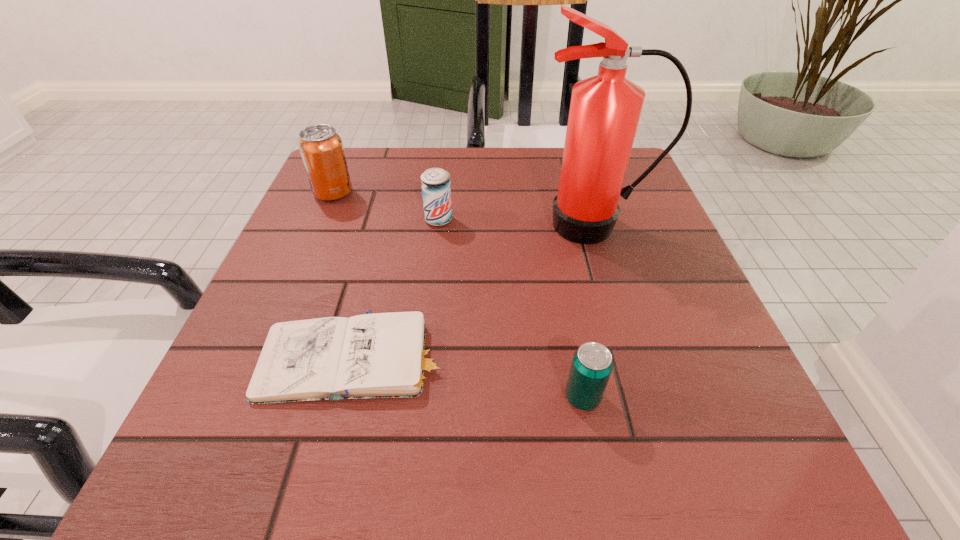
At what (x,y) coordinates should I click in order to perform the action: click on fire extinguisher. Please return your answer as a coordinate pair (x, y). The height and width of the screenshot is (540, 960). Looking at the image, I should click on (604, 112).

Where is `soda can`? soda can is located at coordinates (321, 148).

I want to click on the farthest object, so pyautogui.click(x=321, y=148).

The image size is (960, 540). What are the coordinates of `the farther beer can` in the screenshot? It's located at (436, 191).

Find the location of a particular element. The height and width of the screenshot is (540, 960). the nearer beer can is located at coordinates (592, 364).

The width and height of the screenshot is (960, 540). Identify the location of the shortest object. (383, 355).

Image resolution: width=960 pixels, height=540 pixels. In order to click on vacant point located at the spray nozzle of the fire extinguisher in this screenshot , I will do `click(607, 264)`.

Where is `free space located 0.360m on the right of the farthest object`? Image resolution: width=960 pixels, height=540 pixels. free space located 0.360m on the right of the farthest object is located at coordinates (513, 193).

In order to click on vacant space located on the right of the farther beer can in this screenshot , I will do `click(606, 220)`.

Locate an element on the screen. This screenshot has width=960, height=540. vacant space situated on the back of the right beer can is located at coordinates (553, 238).